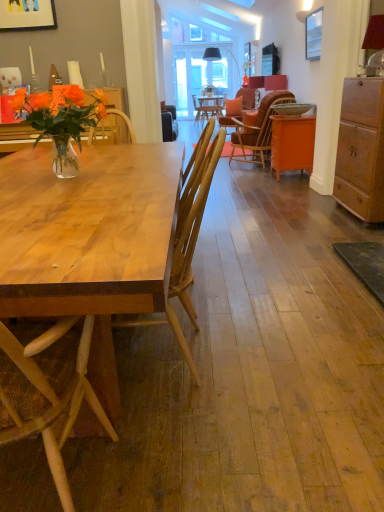
Question: Does orange fabric chair at center, which is the first chair from top to bottom, lie in front of clear glass vase at upper left, which appears as the second desk when ordered from the bottom?

Choices:
 (A) no
 (B) yes

Answer: (A)

Question: Is orange fabric chair at center, the 2th chair positioned from the bottom, facing towards clear glass vase at upper left, which appears as the second desk when ordered from the bottom?

Choices:
 (A) yes
 (B) no

Answer: (B)

Question: Is orange fabric chair at center, which is the first chair from top to bottom, far from clear glass vase at upper left, acting as the first desk starting from the top?

Choices:
 (A) no
 (B) yes

Answer: (B)

Question: Is clear glass vase at upper left, which appears as the second desk when ordered from the bottom, at the back of orange fabric chair at center, the second chair in the front-to-back sequence?

Choices:
 (A) no
 (B) yes

Answer: (A)

Question: Is orange fabric chair at center, the second chair in the front-to-back sequence, further to camera compared to clear glass vase at upper left, acting as the first desk starting from the top?

Choices:
 (A) yes
 (B) no

Answer: (A)

Question: Can you confirm if orange fabric chair at center, which is the first chair from top to bottom, is shorter than clear glass vase at upper left, arranged as the 2th desk when viewed from the front?

Choices:
 (A) no
 (B) yes

Answer: (A)

Question: Does wooden picture frame at upper left, positioned as the 1th picture frame in left-to-right order, appear on the left side of matte white coffee cup at upper left?

Choices:
 (A) no
 (B) yes

Answer: (A)

Question: Does wooden picture frame at upper left, marked as the 1th picture frame in a front-to-back arrangement, have a smaller size compared to matte white coffee cup at upper left?

Choices:
 (A) no
 (B) yes

Answer: (A)

Question: From a real-world perspective, is wooden picture frame at upper left, marked as the 1th picture frame in a front-to-back arrangement, beneath matte white coffee cup at upper left?

Choices:
 (A) yes
 (B) no

Answer: (B)

Question: Is wooden picture frame at upper left, positioned as the 1th picture frame in left-to-right order, turned away from matte white coffee cup at upper left?

Choices:
 (A) no
 (B) yes

Answer: (A)

Question: Is wooden picture frame at upper left, marked as the 1th picture frame in a front-to-back arrangement, outside matte white coffee cup at upper left?

Choices:
 (A) yes
 (B) no

Answer: (A)

Question: Can you confirm if wooden picture frame at upper left, marked as the 1th picture frame in a front-to-back arrangement, is wider than matte white coffee cup at upper left?

Choices:
 (A) yes
 (B) no

Answer: (B)

Question: Is matte white coffee cup at upper left thinner than metallic silver picture frame at upper right, positioned as the 1th picture frame in back-to-front order?

Choices:
 (A) no
 (B) yes

Answer: (A)